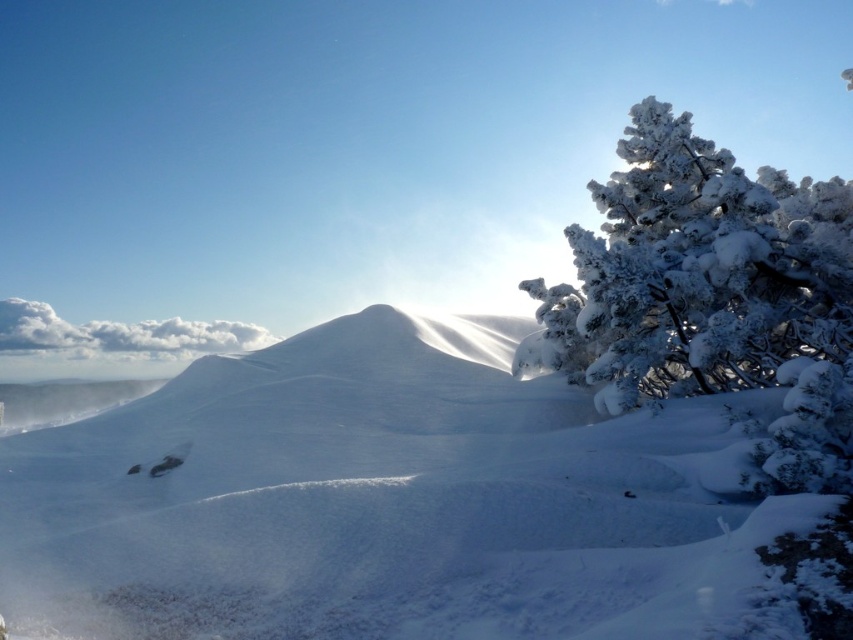
Can you confirm if white frosty tree at right is taller than white fluffy cloud at upper left?

In fact, white frosty tree at right may be shorter than white fluffy cloud at upper left.

Describe the element at coordinates (695, 273) in the screenshot. This screenshot has height=640, width=853. I see `white frosty tree at right` at that location.

Between point (601, 388) and point (252, 342), which one is positioned in front?

Positioned in front is point (601, 388).

Where is `white frosty tree at right`? This screenshot has height=640, width=853. white frosty tree at right is located at coordinates (695, 273).